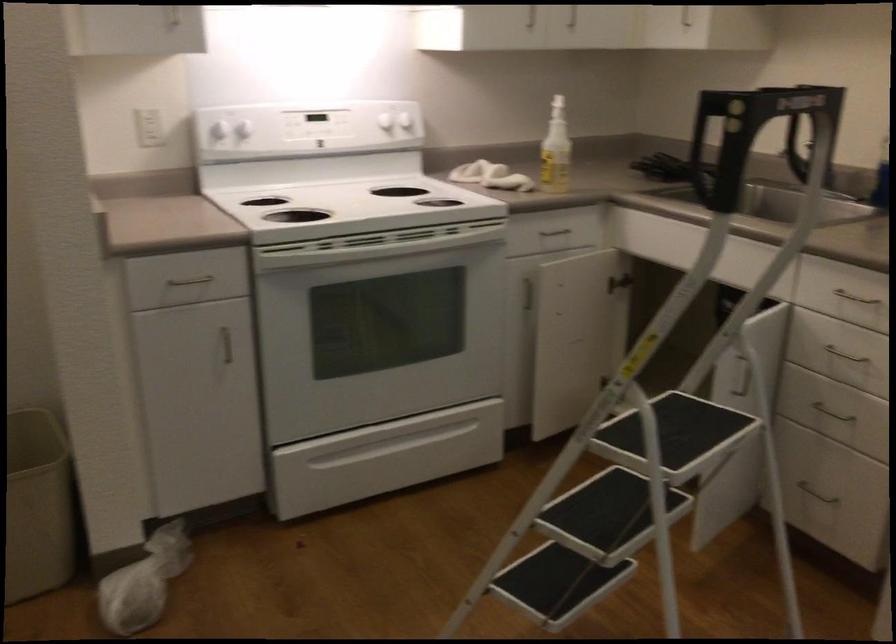
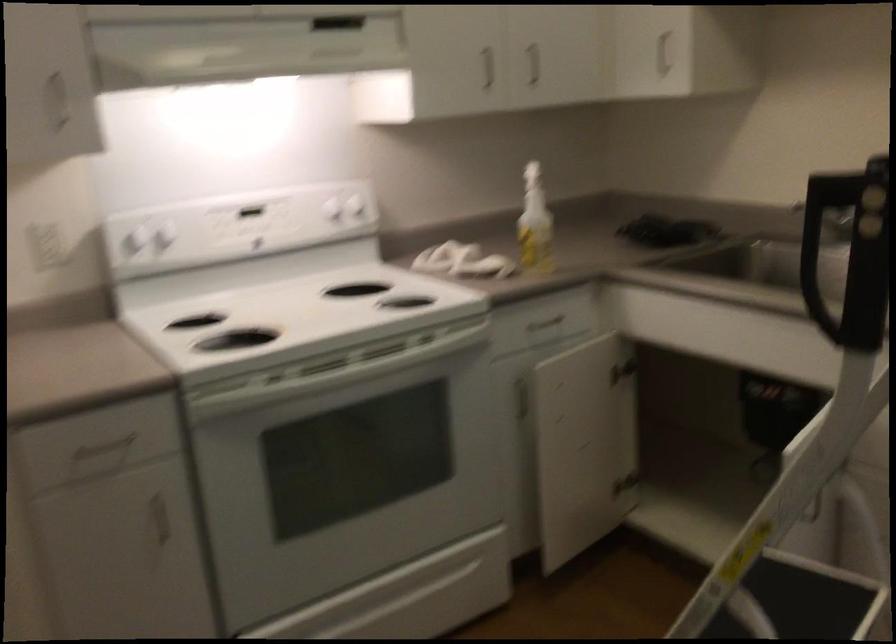
Locate, in the second image, the point that corresponds to point (224, 343) in the first image.

(159, 514)